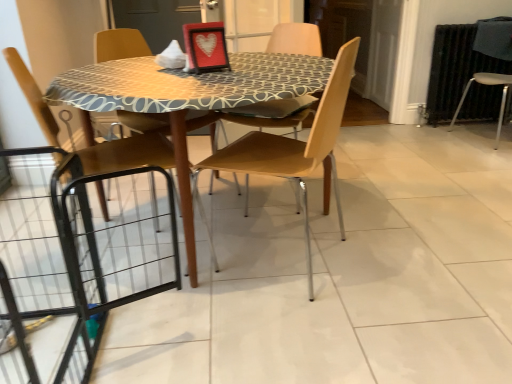
Question: From the image's perspective, is transparent glass screen door at center positioned above or below light brown wood chair at center, the 1th chair when ordered from right to left?

Choices:
 (A) above
 (B) below

Answer: (A)

Question: In the image, is transparent glass screen door at center on the left side or the right side of light brown wood chair at center, which is the third chair in left-to-right order?

Choices:
 (A) left
 (B) right

Answer: (B)

Question: Considering the real-world distances, which object is closest to the wooden chair at left, marked as the first chair in a left-to-right arrangement?

Choices:
 (A) light brown wood chair at center, the 1th chair when ordered from right to left
 (B) transparent glass screen door at center
 (C) black metal radiator at right
 (D) wooden chair at center, the 2th chair positioned from the right
 (E) matte black picture frame at center

Answer: (E)

Question: Which object is the farthest from the matte black picture frame at center?

Choices:
 (A) transparent glass screen door at center
 (B) light brown wood chair at center, the 1th chair when ordered from right to left
 (C) wooden chair at left, which is the 3th chair in right-to-left order
 (D) wooden chair at center, the 2th chair positioned from the right
 (E) black metal radiator at right

Answer: (A)